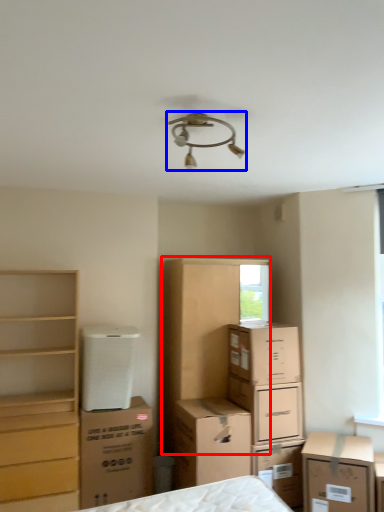
Question: Which object appears closest to the camera in this image, dresser (highlighted by a red box) or lamp (highlighted by a blue box)?

Choices:
 (A) dresser
 (B) lamp

Answer: (B)